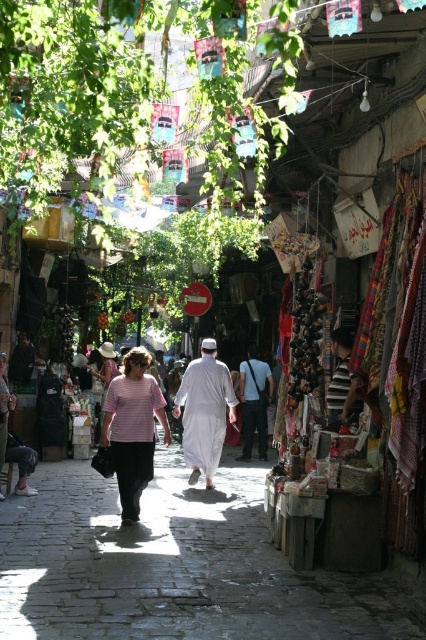
Question: Does pink striped shirt at center come in front of dark gray fabric at center?

Choices:
 (A) no
 (B) yes

Answer: (B)

Question: Which point is farther to the camera?

Choices:
 (A) dark gray fabric at center
 (B) white cotton robe at center
 (C) pink striped shirt at center

Answer: (A)

Question: Based on their relative distances, which object is farther from the smooth stone path at center?

Choices:
 (A) white cotton robe at center
 (B) dark gray fabric at center
 (C) pink fabric dress at center
 (D) pink striped shirt at center

Answer: (C)

Question: Which object appears closest to the camera in this image?

Choices:
 (A) pink striped shirt at center
 (B) pink fabric dress at center
 (C) dark gray fabric at center

Answer: (A)

Question: Where is smooth stone path at center located in relation to pink striped shirt at center in the image?

Choices:
 (A) above
 (B) below

Answer: (B)

Question: Does smooth stone path at center have a lesser width compared to pink striped shirt at center?

Choices:
 (A) yes
 (B) no

Answer: (B)